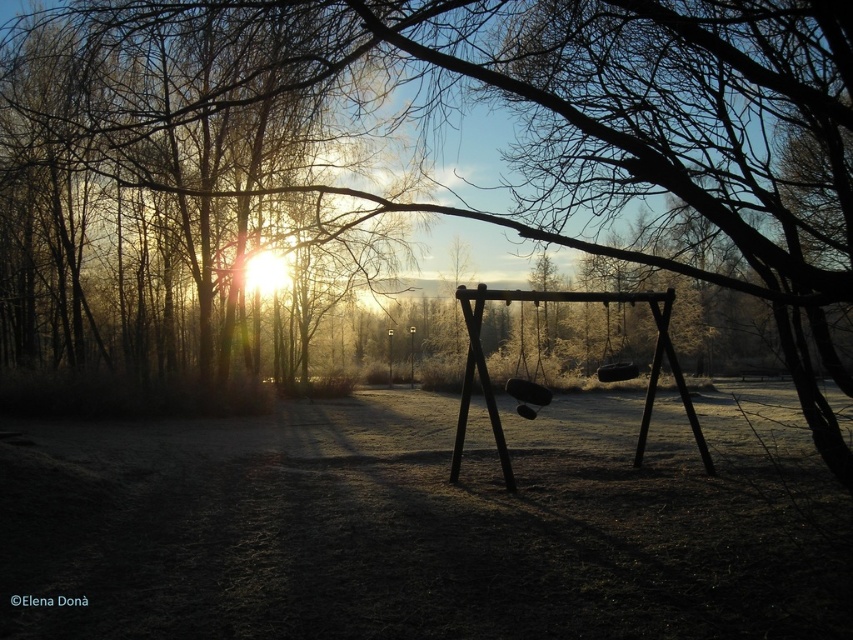
Question: Does brown wooden swing at center appear on the left side of black rubber swing at center?

Choices:
 (A) yes
 (B) no

Answer: (A)

Question: Which of the following is the farthest from the observer?

Choices:
 (A) (523, 384)
 (B) (456, 465)
 (C) (625, 371)

Answer: (C)

Question: Is brown wooden swing at center smaller than black rubber swing at center?

Choices:
 (A) yes
 (B) no

Answer: (A)

Question: Which of the following is the closest to the observer?

Choices:
 (A) brown wooden swing at center
 (B) wooden swing at center

Answer: (A)

Question: Can you confirm if wooden swing at center is positioned below black rubber swing at center?

Choices:
 (A) yes
 (B) no

Answer: (A)

Question: Which point appears closest to the camera in this image?

Choices:
 (A) (538, 403)
 (B) (467, 326)
 (C) (616, 365)

Answer: (B)